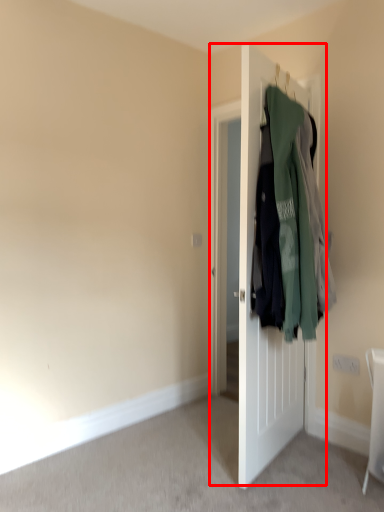
Question: From the image's perspective, what is the correct spatial relationship of door (annotated by the red box) in relation to laundry?

Choices:
 (A) above
 (B) below

Answer: (B)